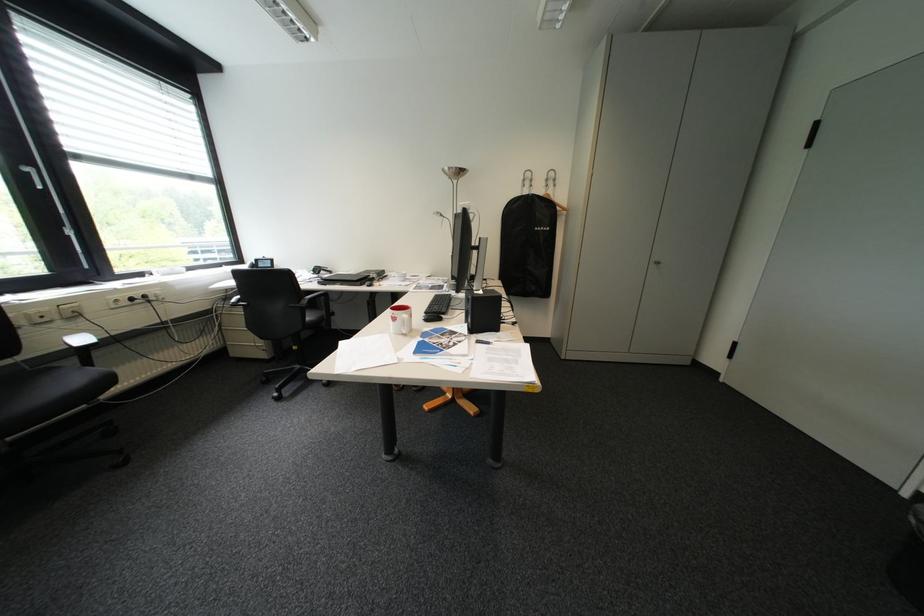
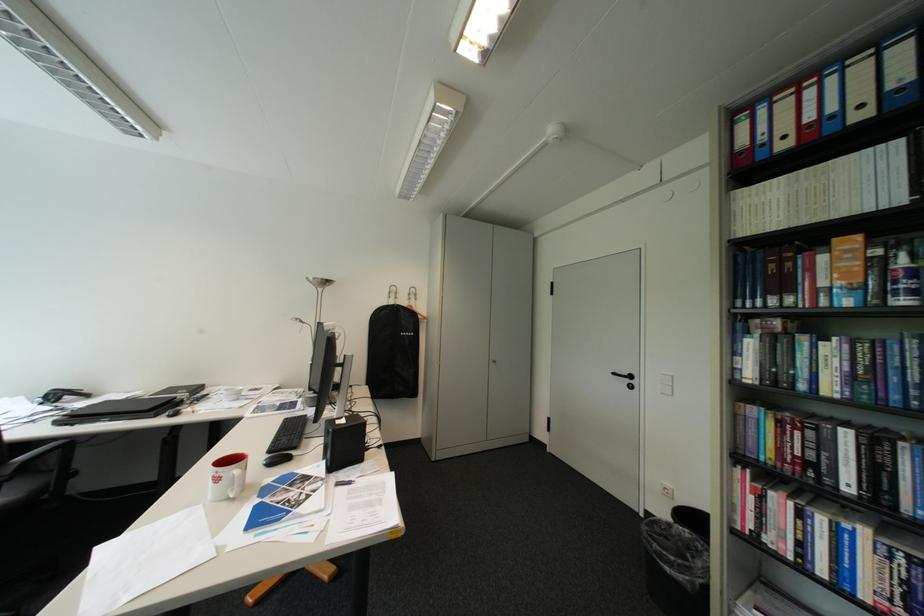
Locate, in the second image, the point that corresponds to point 330,270 in the first image.

(67, 397)